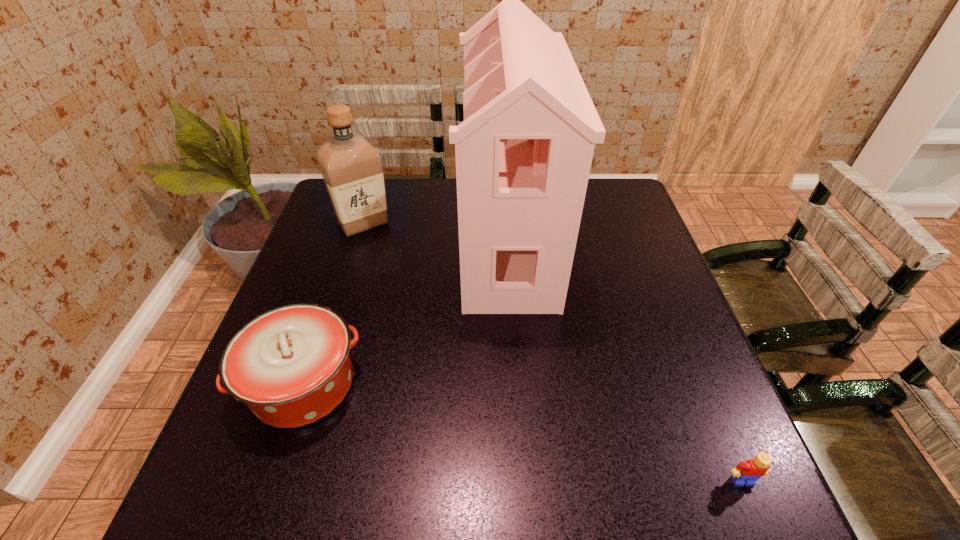
Where is `unoccupied area between the second shortest object and the second tallest object`? Image resolution: width=960 pixels, height=540 pixels. unoccupied area between the second shortest object and the second tallest object is located at coordinates (333, 303).

I want to click on vacant area that lies between the liquor and the casserole, so (x=333, y=303).

You are a GUI agent. You are given a task and a screenshot of the screen. Output one action in this format:
    pyautogui.click(x=<x>, y=<y>)
    Task: Click on the empty location between the Lego and the liquor
    The width and height of the screenshot is (960, 540).
    Given the screenshot: What is the action you would take?
    pyautogui.click(x=553, y=352)

Select which object appears as the third closest to the dollhouse. Please provide its 2D coordinates. Your answer should be formatted as a tuple, i.e. [(x, y)], where the tuple contains the x and y coordinates of a point satisfying the conditions above.

[(746, 473)]

What are the coordinates of `object that stands as the second closest to the shortest object` in the screenshot? It's located at (291, 365).

At what (x,y) coordinates should I click in order to perform the action: click on free region that satisfies the following two spatial constraints: 1. on the front-facing side of the tallest object; 2. on the front side of the casserole. Please return your answer as a coordinate pair (x, y). The height and width of the screenshot is (540, 960). Looking at the image, I should click on (518, 384).

The height and width of the screenshot is (540, 960). In order to click on vacant position in the image that satisfies the following two spatial constraints: 1. on the front-facing side of the dollhouse; 2. on the front side of the casserole in this screenshot , I will do `click(518, 384)`.